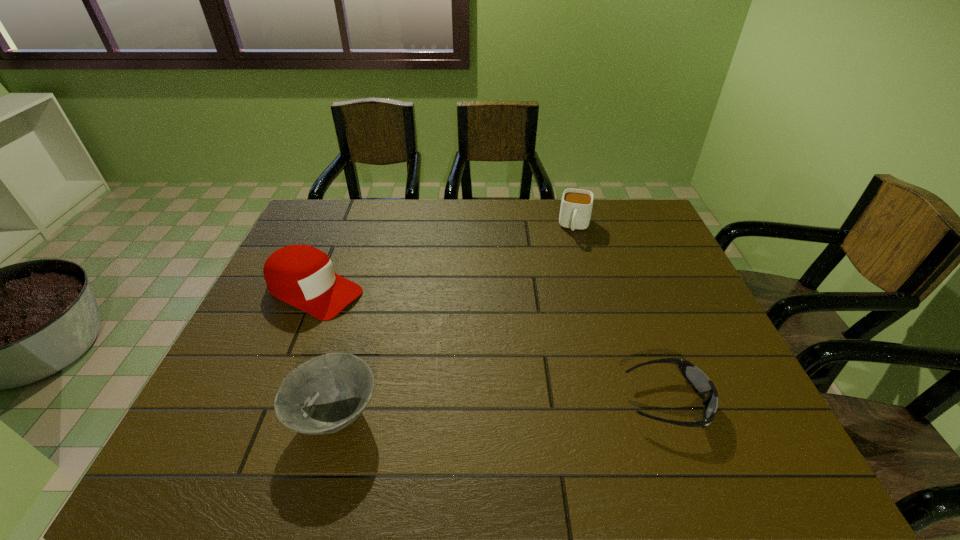
Locate an element on the screen. free space located 0.120m on the front-facing side of the baseball cap is located at coordinates (387, 323).

The image size is (960, 540). What are the coordinates of `free space located 0.400m on the front-facing side of the baseball cap` in the screenshot? It's located at (480, 368).

Locate an element on the screen. This screenshot has height=540, width=960. object that is positioned at the far edge is located at coordinates (576, 206).

Locate an element on the screen. This screenshot has height=540, width=960. bowl that is at the near edge is located at coordinates (327, 393).

Locate an element on the screen. sunglasses that is positioned at the near edge is located at coordinates pyautogui.click(x=701, y=384).

Identify the location of object that is at the left edge. Image resolution: width=960 pixels, height=540 pixels. (300, 275).

Image resolution: width=960 pixels, height=540 pixels. In order to click on object that is at the right edge in this screenshot , I will do `click(701, 384)`.

Image resolution: width=960 pixels, height=540 pixels. Identify the location of object located at the near right corner. (701, 384).

Where is `blank area at the far edge`? The image size is (960, 540). blank area at the far edge is located at coordinates (371, 239).

At what (x,y) coordinates should I click in order to perform the action: click on free space at the near edge of the desktop. Please return your answer as a coordinate pair (x, y). Looking at the image, I should click on (609, 422).